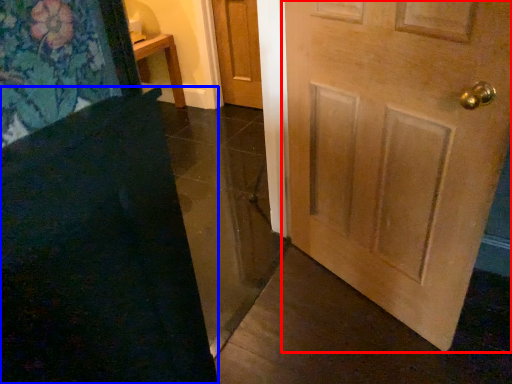
Question: Which object is further to the camera taking this photo, door (highlighted by a red box) or doormat (highlighted by a blue box)?

Choices:
 (A) door
 (B) doormat

Answer: (A)